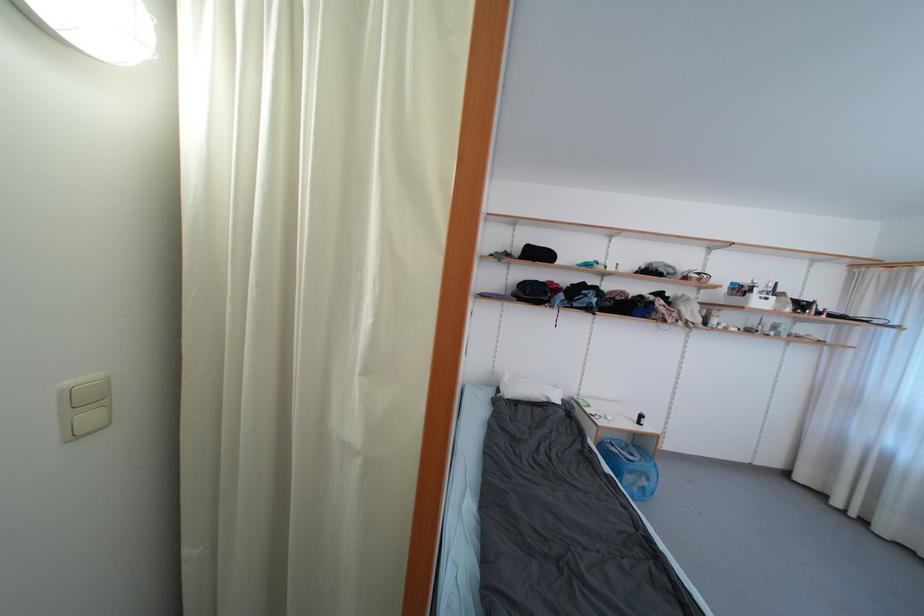
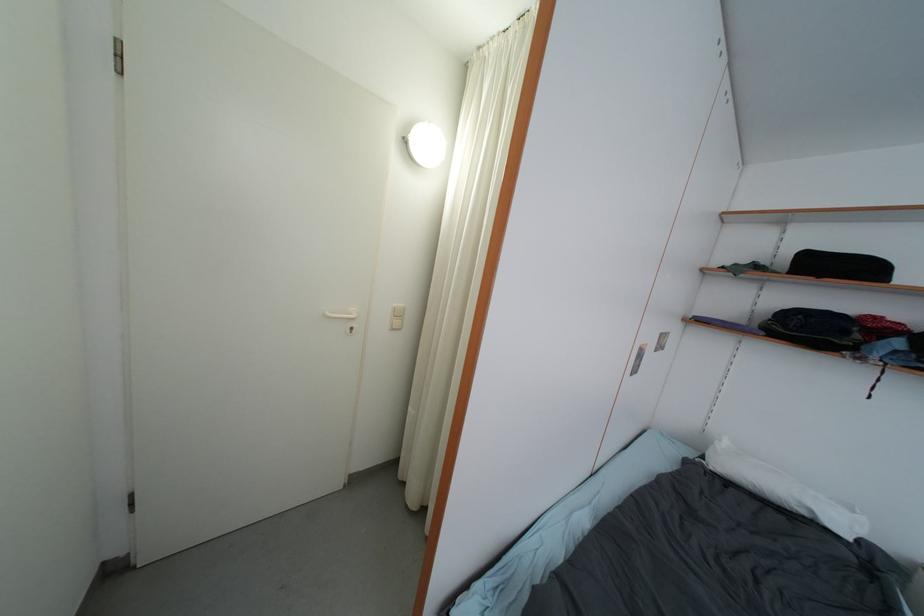
Question: The camera is either moving clockwise (left) or counter-clockwise (right) around the object. The first image is from the beginning of the video and the second image is from the end. Is the camera moving left or right when shooting the video?

Choices:
 (A) Left
 (B) Right

Answer: (B)